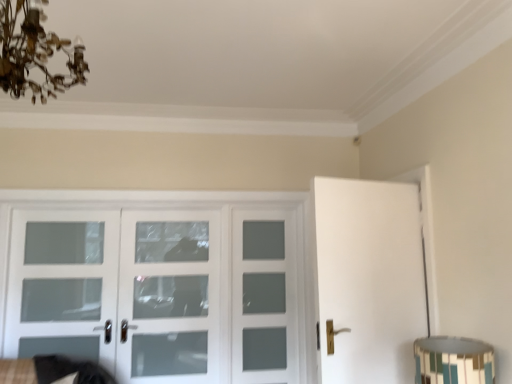
What is the approximate width of white frosted glass door at center, arranged as the 2th screen door when viewed from the left?

white frosted glass door at center, arranged as the 2th screen door when viewed from the left, is 3.15 inches in width.

Where is `white glass door at center`? This screenshot has height=384, width=512. white glass door at center is located at coordinates (159, 285).

Measure the distance between point [44,15] and camera.

2.05 meters.

The image size is (512, 384). Identify the location of white frosted glass door at center, the 1th screen door in the right-to-left sequence. (264, 298).

Image resolution: width=512 pixels, height=384 pixels. Find the location of `multicolored mosaic lampshade at lower right`. multicolored mosaic lampshade at lower right is located at coordinates (453, 361).

Between antique brass chandelier at upper left and clear glass door at left, which is the third screen door from right to left, which one is positioned behind?

Positioned behind is clear glass door at left, which is the third screen door from right to left.

Would you say antique brass chandelier at upper left is to the left or to the right of clear glass door at left, which is the third screen door from right to left, in the picture?

antique brass chandelier at upper left is to the right of clear glass door at left, which is the third screen door from right to left.

From the image's perspective, is antique brass chandelier at upper left located above or below clear glass door at left, which is counted as the first screen door, starting from the left?

Based on their image positions, antique brass chandelier at upper left is located above clear glass door at left, which is counted as the first screen door, starting from the left.

In the scene shown: Is antique brass chandelier at upper left outside of clear glass door at left, which is counted as the first screen door, starting from the left?

antique brass chandelier at upper left is positioned outside clear glass door at left, which is counted as the first screen door, starting from the left.

From the image's perspective, which object appears higher, white frosted glass door at center, arranged as the second screen door when viewed from the right, or white glass door at center?

white frosted glass door at center, arranged as the second screen door when viewed from the right, appears higher in the image.

Is point (192, 284) closer or farther from the camera than point (110, 368)?

Point (192, 284) is positioned farther from the camera compared to point (110, 368).

From the picture: Considering the sizes of white frosted glass door at center, arranged as the 2th screen door when viewed from the left, and white glass door at center in the image, is white frosted glass door at center, arranged as the 2th screen door when viewed from the left, taller or shorter than white glass door at center?

Clearly, white frosted glass door at center, arranged as the 2th screen door when viewed from the left, is taller compared to white glass door at center.

Can you confirm if white frosted glass door at center, arranged as the 2th screen door when viewed from the left, is thinner than white glass door at center?

Indeed, white frosted glass door at center, arranged as the 2th screen door when viewed from the left, has a lesser width compared to white glass door at center.

Is white glass door at center positioned beyond the bounds of clear glass door at left, which is counted as the first screen door, starting from the left?

That's correct, white glass door at center is outside of clear glass door at left, which is counted as the first screen door, starting from the left.

Based on their sizes in the image, would you say white glass door at center is bigger or smaller than clear glass door at left, which is counted as the first screen door, starting from the left?

In the image, white glass door at center appears to be larger than clear glass door at left, which is counted as the first screen door, starting from the left.

Is white glass door at center aimed at clear glass door at left, which is counted as the first screen door, starting from the left?

Yes.

Looking at this image, from a real-world perspective, is white glass door at center below clear glass door at left, which is the third screen door from right to left?

Indeed, from a real-world perspective, white glass door at center is positioned beneath clear glass door at left, which is the third screen door from right to left.

Is white frosted glass door at center, arranged as the 2th screen door when viewed from the left, taller or shorter than clear glass door at left, which is counted as the first screen door, starting from the left?

Considering their sizes, white frosted glass door at center, arranged as the 2th screen door when viewed from the left, has more height than clear glass door at left, which is counted as the first screen door, starting from the left.

What are the coordinates of `screen door that is the 1st object located behind the clear glass door at left, which is the third screen door from right to left` in the screenshot? It's located at (168, 297).

In the scene shown: Is white frosted glass door at center, arranged as the 2th screen door when viewed from the left, inside or outside of clear glass door at left, which is the third screen door from right to left?

white frosted glass door at center, arranged as the 2th screen door when viewed from the left, is located beyond the bounds of clear glass door at left, which is the third screen door from right to left.

From a real-world perspective, which object rests below the other?

white frosted glass door at center, arranged as the 2th screen door when viewed from the left, from a real-world perspective.

Which is correct: multicolored mosaic lampshade at lower right is inside antique brass chandelier at upper left, or outside of it?

multicolored mosaic lampshade at lower right is spatially situated outside antique brass chandelier at upper left.

From the image's perspective, which is below, multicolored mosaic lampshade at lower right or antique brass chandelier at upper left?

multicolored mosaic lampshade at lower right.

Relative to antique brass chandelier at upper left, is multicolored mosaic lampshade at lower right in front or behind?

Clearly, multicolored mosaic lampshade at lower right is behind antique brass chandelier at upper left.

How much distance is there between multicolored mosaic lampshade at lower right and antique brass chandelier at upper left?

multicolored mosaic lampshade at lower right is 1.98 meters away from antique brass chandelier at upper left.

Can you confirm if white frosted glass door at center, placed as the 3th screen door when sorted from left to right, is positioned to the right of antique brass chandelier at upper left?

Yes.

From a real-world perspective, is white frosted glass door at center, the 1th screen door in the right-to-left sequence, located higher than antique brass chandelier at upper left?

Incorrect, from a real-world perspective, white frosted glass door at center, the 1th screen door in the right-to-left sequence, is lower than antique brass chandelier at upper left.

Which is behind, white frosted glass door at center, the 1th screen door in the right-to-left sequence, or antique brass chandelier at upper left?

white frosted glass door at center, the 1th screen door in the right-to-left sequence, is further from the camera.

Can you confirm if white frosted glass door at center, the 1th screen door in the right-to-left sequence, is thinner than antique brass chandelier at upper left?

Correct, the width of white frosted glass door at center, the 1th screen door in the right-to-left sequence, is less than that of antique brass chandelier at upper left.

Does clear glass door at left, which is the third screen door from right to left, have a smaller size compared to antique brass chandelier at upper left?

Correct, clear glass door at left, which is the third screen door from right to left, occupies less space than antique brass chandelier at upper left.

Is clear glass door at left, which is counted as the first screen door, starting from the left, completely or partially outside of antique brass chandelier at upper left?

clear glass door at left, which is counted as the first screen door, starting from the left, is positioned outside antique brass chandelier at upper left.

Which point is more forward, (46,254) or (7,66)?

Point (7,66)

Considering the sizes of clear glass door at left, which is the third screen door from right to left, and antique brass chandelier at upper left in the image, is clear glass door at left, which is the third screen door from right to left, wider or thinner than antique brass chandelier at upper left?

Clearly, clear glass door at left, which is the third screen door from right to left, has less width compared to antique brass chandelier at upper left.

You are a GUI agent. You are given a task and a screenshot of the screen. Output one action in this format:
    pyautogui.click(x=<x>, y=<y>)
    Task: Click on the screen door that is the 1st one when counting backward from the antique brass chandelier at upper left
    The image size is (512, 384).
    Given the screenshot: What is the action you would take?
    pyautogui.click(x=63, y=284)

I want to click on door that is on the left side of white frosted glass door at center, arranged as the 2th screen door when viewed from the left, so click(159, 285).

Looking at the image, which one is located further to clear glass door at left, which is counted as the first screen door, starting from the left, white frosted glass door at center, arranged as the second screen door when viewed from the right, or antique brass chandelier at upper left?

The object further to clear glass door at left, which is counted as the first screen door, starting from the left, is antique brass chandelier at upper left.

Which object lies nearer to the anchor point multicolored mosaic lampshade at lower right, white frosted glass door at center, placed as the 3th screen door when sorted from left to right, or clear glass door at left, which is the third screen door from right to left?

white frosted glass door at center, placed as the 3th screen door when sorted from left to right, lies closer to multicolored mosaic lampshade at lower right than the other object.

Which object lies further to the anchor point multicolored mosaic lampshade at lower right, white frosted glass door at center, arranged as the 2th screen door when viewed from the left, or white frosted glass door at center, placed as the 3th screen door when sorted from left to right?

white frosted glass door at center, arranged as the 2th screen door when viewed from the left.

Based on their spatial positions, is white frosted glass door at center, the 1th screen door in the right-to-left sequence, or multicolored mosaic lampshade at lower right closer to white frosted glass door at center, arranged as the 2th screen door when viewed from the left?

white frosted glass door at center, the 1th screen door in the right-to-left sequence, is closer to white frosted glass door at center, arranged as the 2th screen door when viewed from the left.

Based on their spatial positions, is white frosted glass door at center, the 1th screen door in the right-to-left sequence, or white glass door at center closer to white frosted glass door at center, arranged as the 2th screen door when viewed from the left?

Based on the image, white glass door at center appears to be nearer to white frosted glass door at center, arranged as the 2th screen door when viewed from the left.

Looking at the image, which one is located further to white frosted glass door at center, arranged as the second screen door when viewed from the right, white glass door at center or antique brass chandelier at upper left?

Based on the image, antique brass chandelier at upper left appears to be further to white frosted glass door at center, arranged as the second screen door when viewed from the right.

When comparing their distances from white frosted glass door at center, the 1th screen door in the right-to-left sequence, does white glass door at center or antique brass chandelier at upper left seem closer?

white glass door at center lies closer to white frosted glass door at center, the 1th screen door in the right-to-left sequence, than the other object.

Based on their spatial positions, is antique brass chandelier at upper left or white frosted glass door at center, the 1th screen door in the right-to-left sequence, closer to clear glass door at left, which is counted as the first screen door, starting from the left?

The object closer to clear glass door at left, which is counted as the first screen door, starting from the left, is white frosted glass door at center, the 1th screen door in the right-to-left sequence.

At what (x,y) coordinates should I click in order to perform the action: click on table lamp between antique brass chandelier at upper left and white glass door at center along the z-axis. Please return your answer as a coordinate pair (x, y). Image resolution: width=512 pixels, height=384 pixels. Looking at the image, I should click on (453, 361).

I want to click on door situated between clear glass door at left, which is counted as the first screen door, starting from the left, and white frosted glass door at center, arranged as the second screen door when viewed from the right, from left to right, so click(x=159, y=285).

Identify the location of screen door located between white glass door at center and white frosted glass door at center, placed as the 3th screen door when sorted from left to right, in the left-right direction. click(168, 297).

You are a GUI agent. You are given a task and a screenshot of the screen. Output one action in this format:
    pyautogui.click(x=<x>, y=<y>)
    Task: Click on the door situated between clear glass door at left, which is counted as the first screen door, starting from the left, and multicolored mosaic lampshade at lower right from left to right
    This screenshot has height=384, width=512.
    Given the screenshot: What is the action you would take?
    pyautogui.click(x=159, y=285)